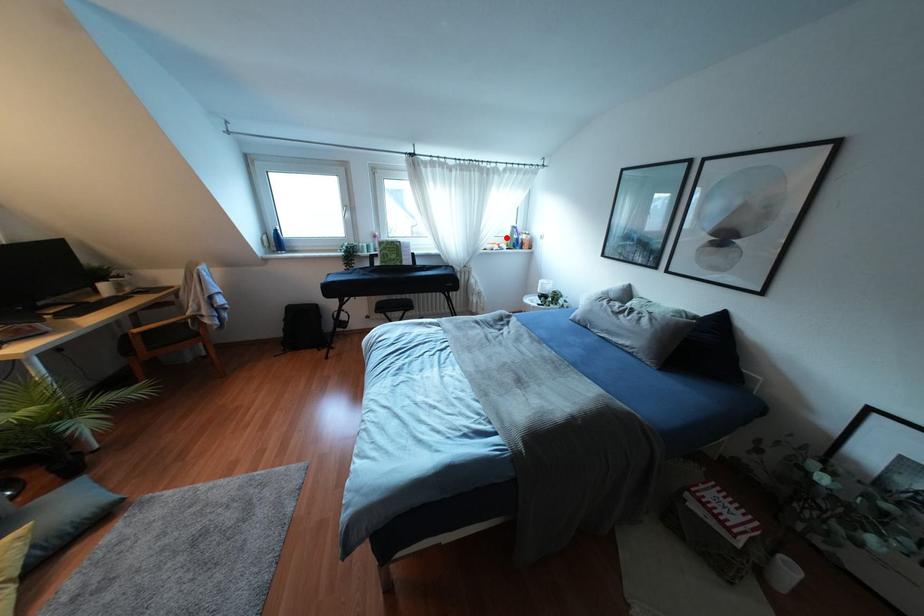
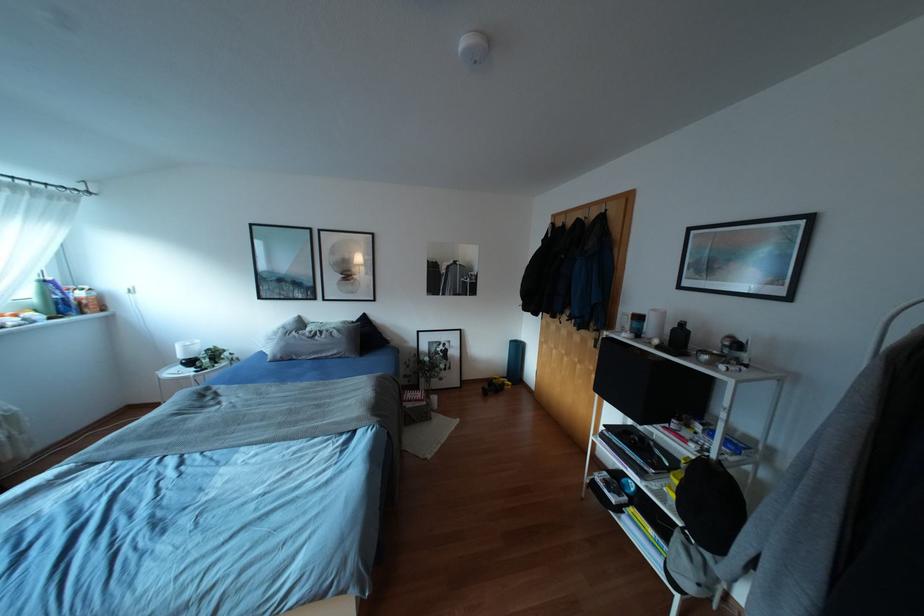
Question: I am providing you with two images of the same scene from different viewpoints. Given a red point in image1, look at the same physical point in image2. Is it:

Choices:
 (A) Closer to the viewpoint
 (B) Farther from the viewpoint

Answer: (B)